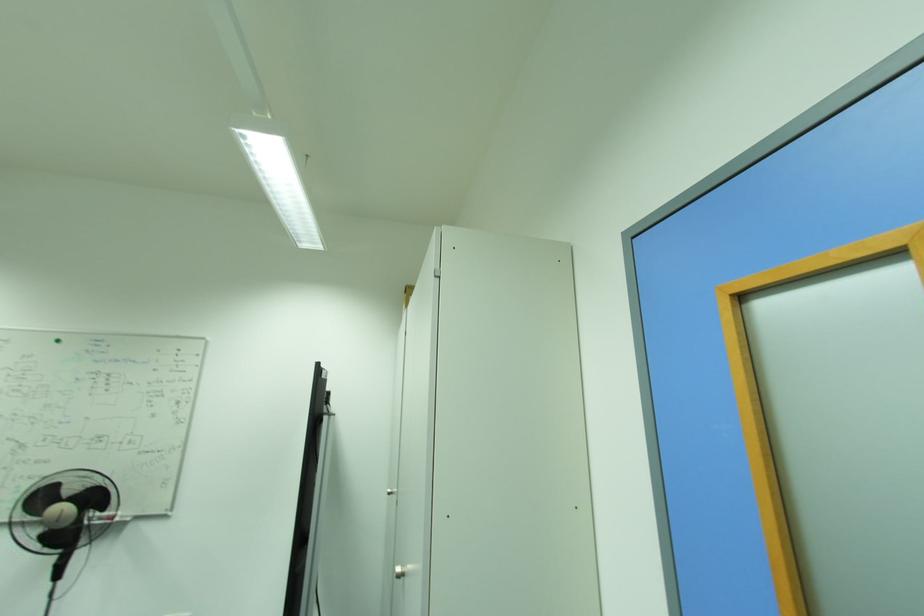
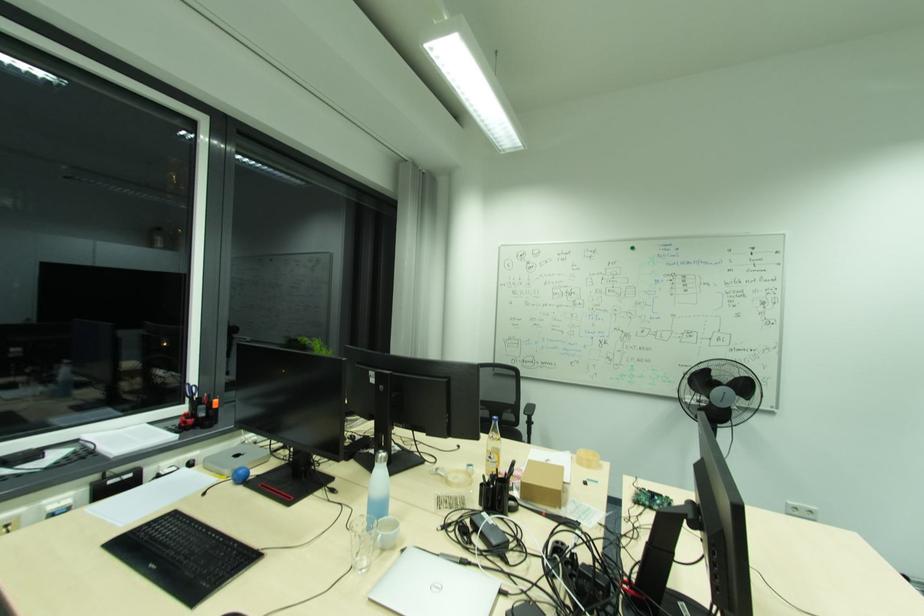
The point at [101,496] is marked in the first image. Where is the corresponding point in the second image?

(748, 387)